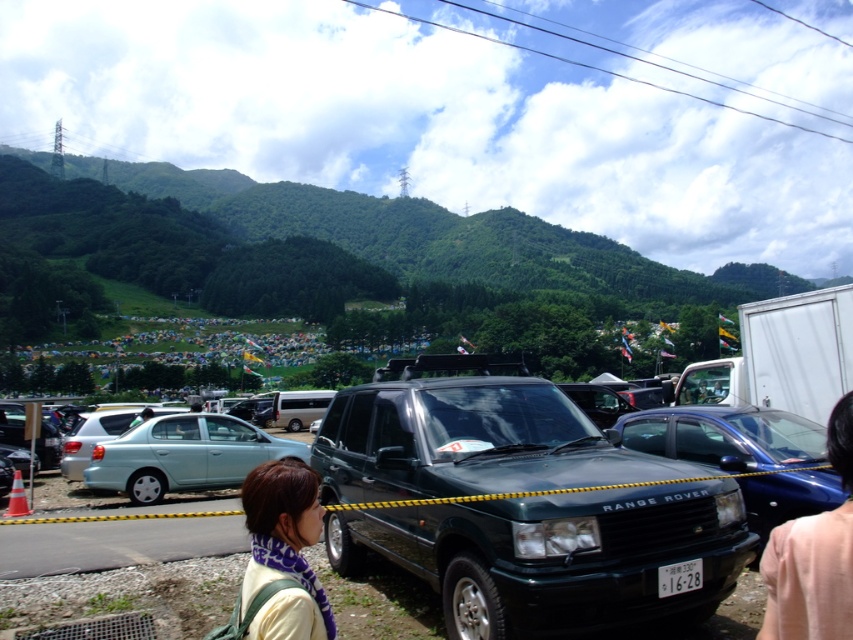
Question: Estimate the real-world distances between objects in this image. Which object is closer to the light blue metallic sedan at left?

Choices:
 (A) light yellow fabric at center
 (B) light blue metallic sedan at center-left

Answer: (B)

Question: Can you confirm if metallic green suv at center is bigger than metallic green range rover at center?

Choices:
 (A) no
 (B) yes

Answer: (B)

Question: Estimate the real-world distances between objects in this image. Which object is closer to the light yellow fabric at center?

Choices:
 (A) light blue metallic sedan at center-left
 (B) metallic green suv at center
 (C) metallic green range rover at center
 (D) smooth skin at lower right

Answer: (D)

Question: Which point is farther to the camera?

Choices:
 (A) light blue metallic sedan at left
 (B) light blue metallic sedan at center-left
 (C) metallic green suv at center
 (D) smooth skin at lower right

Answer: (B)

Question: Is smooth skin at lower right to the left of light yellow fabric at center from the viewer's perspective?

Choices:
 (A) yes
 (B) no

Answer: (B)

Question: In this image, where is light blue metallic sedan at left located relative to light yellow fabric at center?

Choices:
 (A) right
 (B) left

Answer: (B)